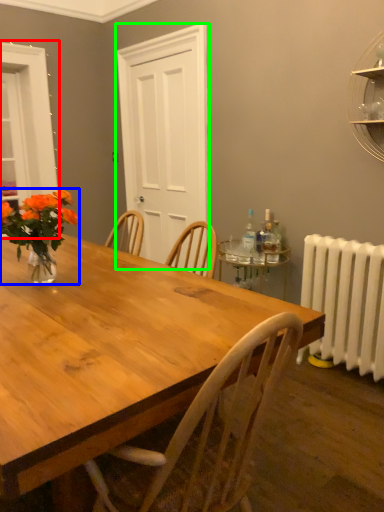
Question: Which is nearer to the window (highlighted by a red box)? houseplant (highlighted by a blue box) or glass door (highlighted by a green box).

Choices:
 (A) houseplant
 (B) glass door

Answer: (B)